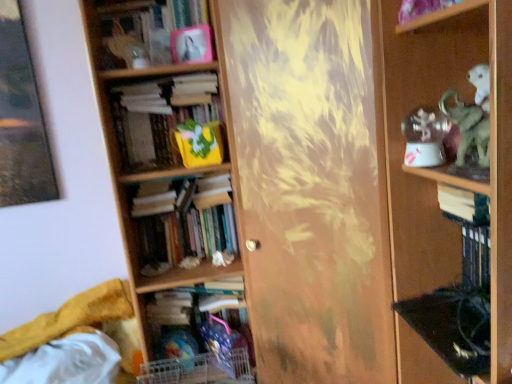
Question: Based on their sizes in the image, would you say matte pink photo frame at upper center, marked as the 1th book in a top-to-bottom arrangement, is bigger or smaller than yellow fabric bag at center-left, which appears as the second book when viewed from the top?

Choices:
 (A) big
 (B) small

Answer: (A)

Question: Considering the positions of matte pink photo frame at upper center, which is the 5th book from bottom to top, and yellow fabric bag at center-left, which appears as the second book when viewed from the top, in the image, is matte pink photo frame at upper center, which is the 5th book from bottom to top, wider or thinner than yellow fabric bag at center-left, which appears as the second book when viewed from the top,?

Choices:
 (A) thin
 (B) wide

Answer: (A)

Question: Considering the real-world distances, which object is farthest from the white paper book at right, marked as the third book in a bottom-to-top arrangement?

Choices:
 (A) wooden shelf at right
 (B) matte pink photo frame at upper center, which is the 5th book from bottom to top
 (C) wooden bookcase at left
 (D) hardcover books at center, which is the fourth book from top to bottom
 (E) translucent plastic toy at lower center

Answer: (B)

Question: Which object is positioned farthest from the hardcover book at lower center, the 1th book in the bottom-to-top sequence?

Choices:
 (A) yellow fabric bag at center-left, which appears as the second book when viewed from the top
 (B) white paper book at right, marked as the third book in a bottom-to-top arrangement
 (C) wooden shelf at right
 (D) hardcover books at center, which appears as the 2th book when ordered from the bottom
 (E) wooden bookcase at left

Answer: (B)